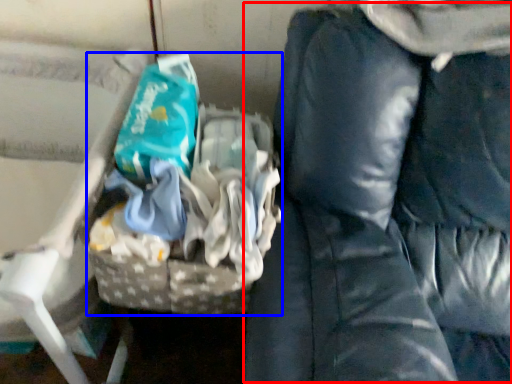
Question: Which of the following is the farthest to the observer, bean bag chair (highlighted by a red box) or waste (highlighted by a blue box)?

Choices:
 (A) bean bag chair
 (B) waste

Answer: (B)